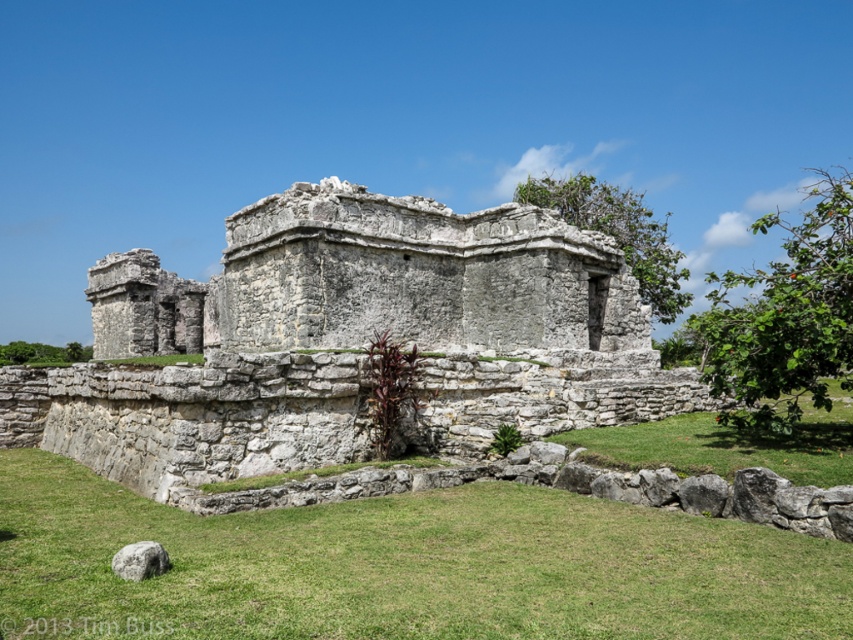
Question: Can you confirm if gray stone ruins at center is wider than transparent watermark at lower left?

Choices:
 (A) yes
 (B) no

Answer: (A)

Question: Which point is closer to the camera taking this photo?

Choices:
 (A) (160, 632)
 (B) (527, 426)

Answer: (A)

Question: Which point is farther to the camera?

Choices:
 (A) transparent watermark at lower left
 (B) gray stone ruins at center

Answer: (B)

Question: Does gray stone ruins at center have a lesser width compared to transparent watermark at lower left?

Choices:
 (A) yes
 (B) no

Answer: (B)

Question: Can you confirm if gray stone ruins at center is wider than transparent watermark at lower left?

Choices:
 (A) yes
 (B) no

Answer: (A)